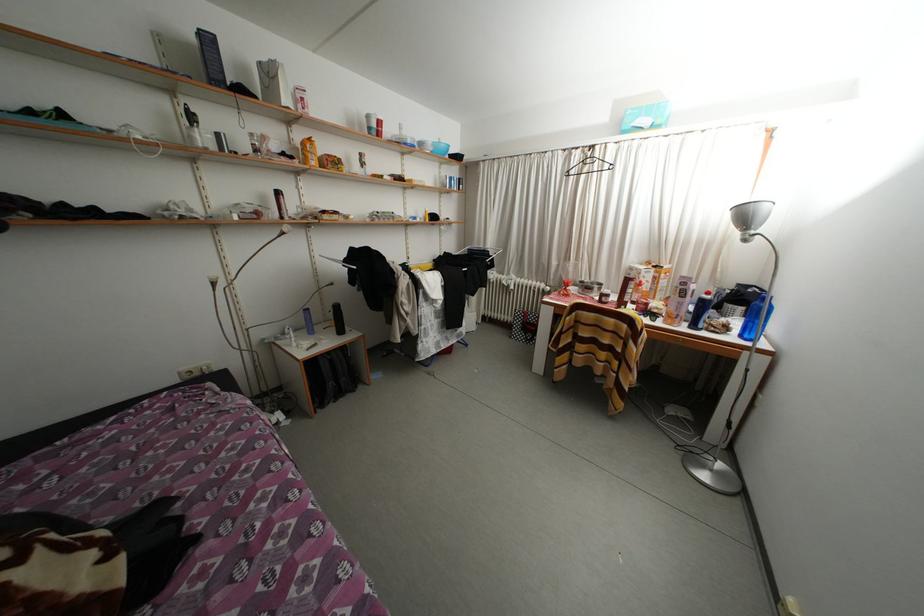
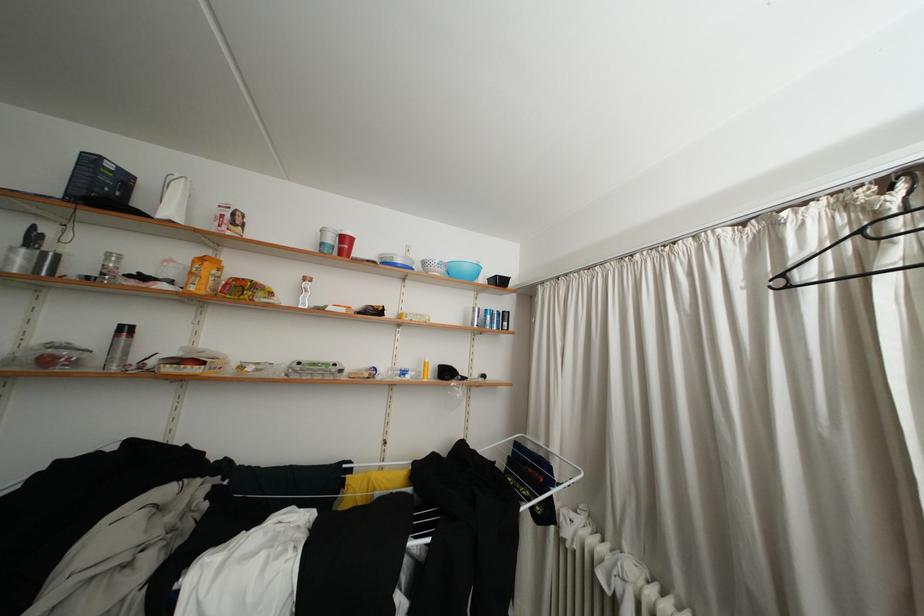
Where in the second image is the point corresponding to [199,143] from the first image?

(17, 264)